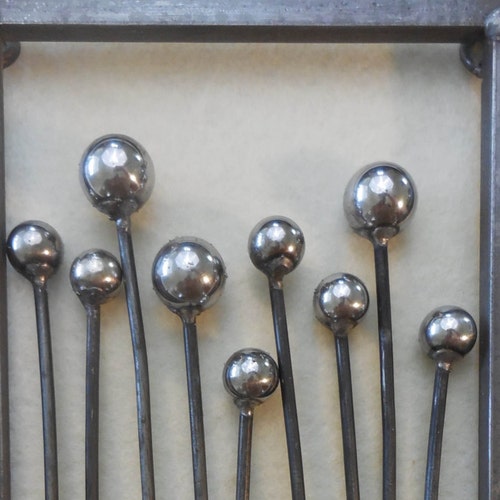
The image size is (500, 500). Find the location of `metal frame`. metal frame is located at coordinates (235, 20), (488, 241).